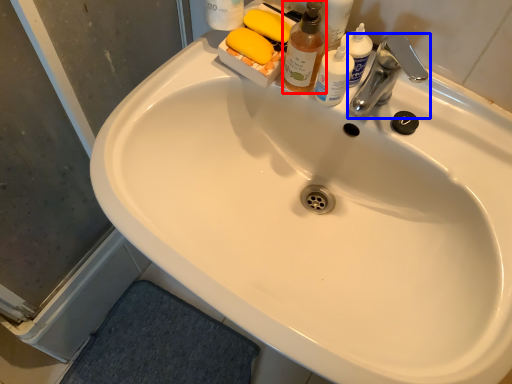
Question: Which of the following is the farthest to the observer, cleaning product (highlighted by a red box) or tap (highlighted by a blue box)?

Choices:
 (A) cleaning product
 (B) tap

Answer: (B)